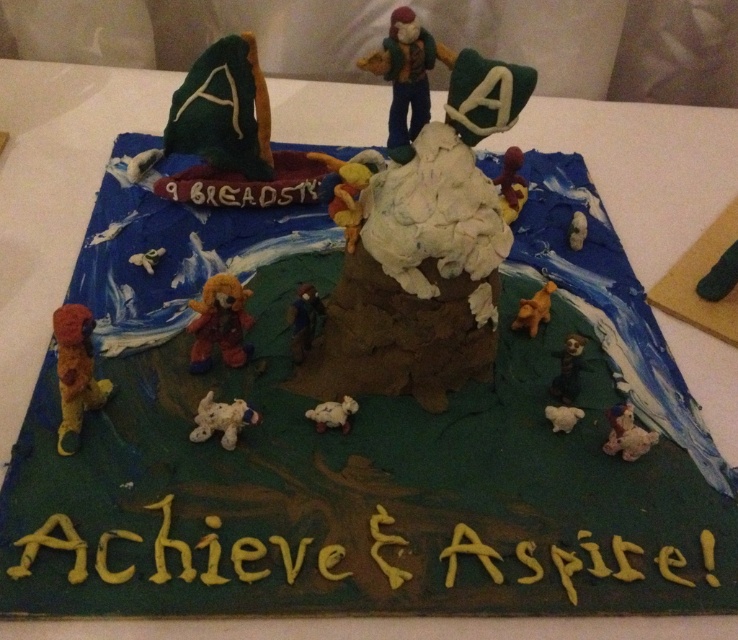
Does white fluffy teddy bear at lower right appear over white plastic dog at lower right?

No.

Based on the photo, is the position of white fluffy teddy bear at lower right more distant than that of white plastic dog at lower right?

No.

Find the location of a particular element. Image resolution: width=738 pixels, height=640 pixels. white fluffy teddy bear at lower right is located at coordinates pos(627,435).

Is point (293, 308) in front of point (528, 308)?

Yes, it is in front of point (528, 308).

Between black plastic figure at center and yellow plastic dog at lower right, which one has less height?

yellow plastic dog at lower right is shorter.

Find the location of a particular element. black plastic figure at center is located at coordinates (303, 320).

This screenshot has width=738, height=640. What are the coordinates of `black plastic figure at center` in the screenshot? It's located at (303, 320).

Does white fluffy teddy bear at lower right appear under white plastic bear at center?

Indeed, white fluffy teddy bear at lower right is positioned under white plastic bear at center.

Is point (610, 435) in front of point (582, 225)?

Yes.

Locate an element on the screen. white fluffy teddy bear at lower right is located at coordinates (627, 435).